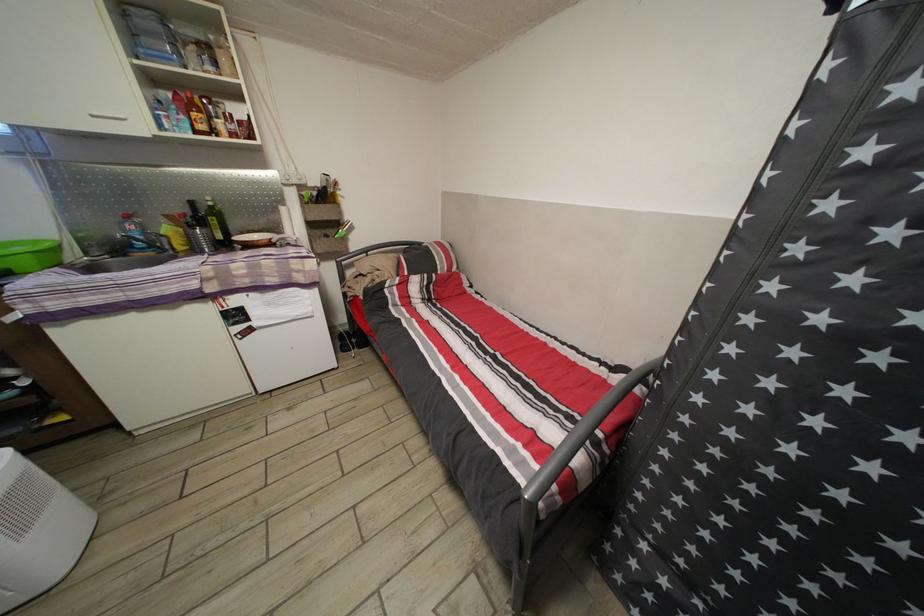
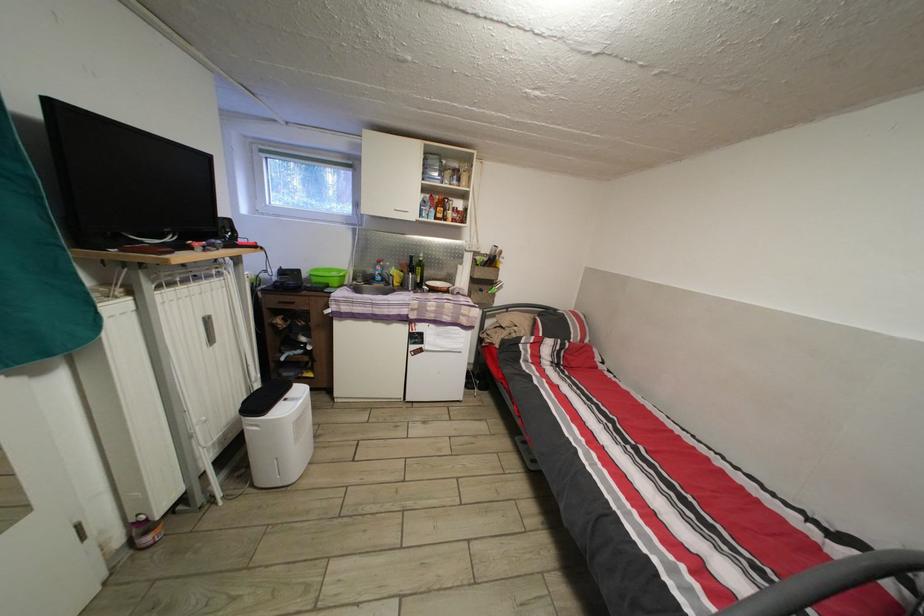
Question: I am providing you with two images of the same scene from different viewpoints. After the viewpoint changes to image2, which objects are now occluded?

Choices:
 (A) small purple bottle
 (B) yellow bottle
 (C) olive oil bottle
 (D) none of these

Answer: (D)